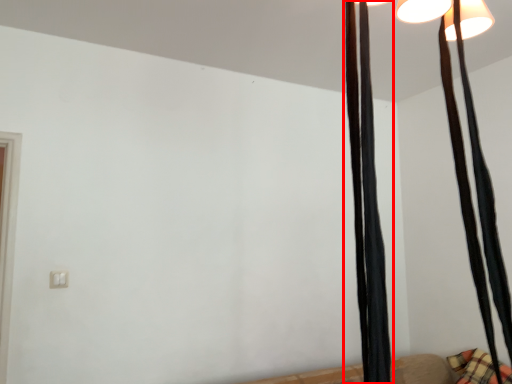
Question: From the image's perspective, where is curtain (annotated by the red box) located relative to curtain?

Choices:
 (A) above
 (B) below

Answer: (B)